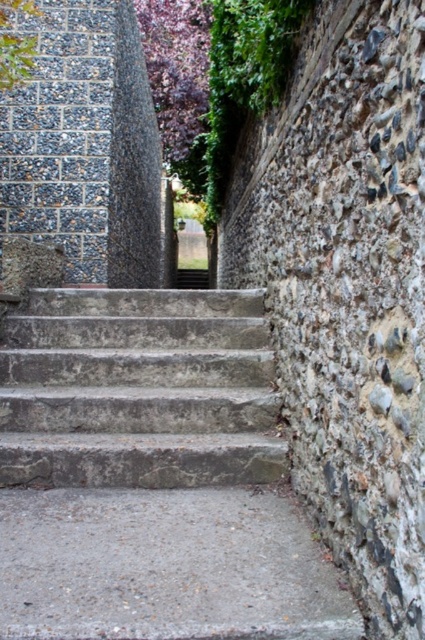
Question: From the image, what is the correct spatial relationship of gray concrete stairs at center in relation to gray stone stairs at center?

Choices:
 (A) above
 (B) below

Answer: (B)

Question: Which point appears closest to the camera in this image?

Choices:
 (A) (121, 358)
 (B) (173, 410)

Answer: (B)

Question: Does gray concrete stairs at center lie behind gray stone stairs at center?

Choices:
 (A) yes
 (B) no

Answer: (B)

Question: Can you confirm if gray concrete stairs at center is positioned to the left of gray stone stairs at center?

Choices:
 (A) yes
 (B) no

Answer: (B)

Question: Which of the following is the closest to the observer?

Choices:
 (A) (36, 394)
 (B) (0, 458)

Answer: (B)